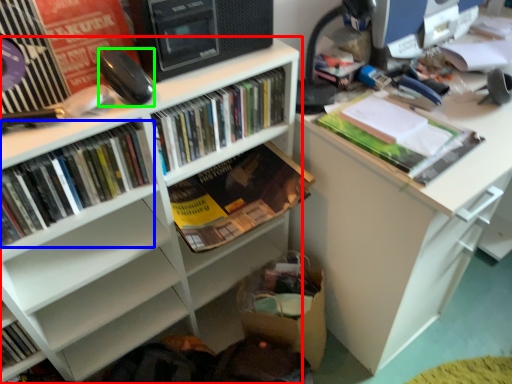
Question: Which is farther away from bookcase (highlighted by a red box)? book (highlighted by a blue box) or equipment (highlighted by a green box)?

Choices:
 (A) book
 (B) equipment

Answer: (B)